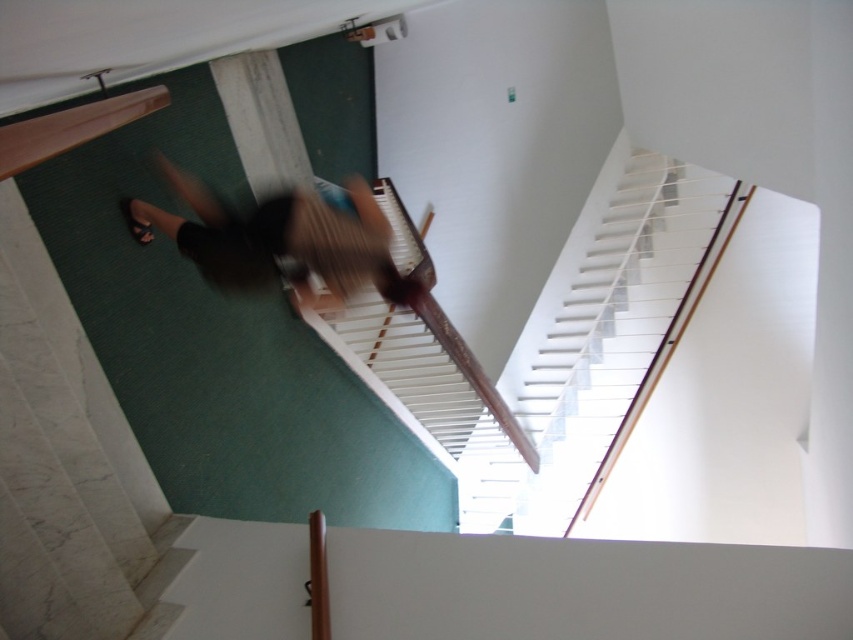
Question: Among these objects, which one is farthest from the camera?

Choices:
 (A) white wooden stairs at upper center
 (B) blurred black shorts at center

Answer: (A)

Question: Does white wooden stairs at upper center appear on the right side of blurred black shorts at center?

Choices:
 (A) yes
 (B) no

Answer: (A)

Question: Does white wooden stairs at upper center have a greater width compared to blurred black shorts at center?

Choices:
 (A) no
 (B) yes

Answer: (B)

Question: Can you confirm if white wooden stairs at upper center is bigger than blurred black shorts at center?

Choices:
 (A) yes
 (B) no

Answer: (A)